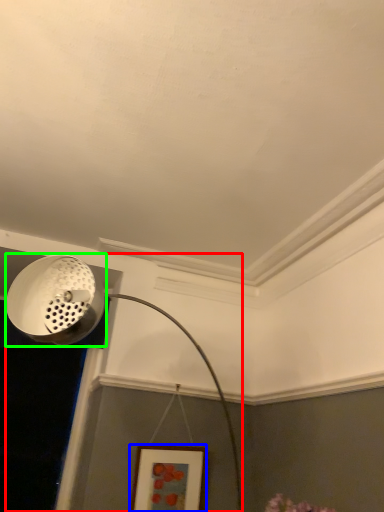
Question: Estimate the real-world distances between objects in this image. Which object is closer to lamp (highlighted by a red box), picture frame (highlighted by a blue box) or light fixture (highlighted by a green box)?

Choices:
 (A) picture frame
 (B) light fixture

Answer: (B)